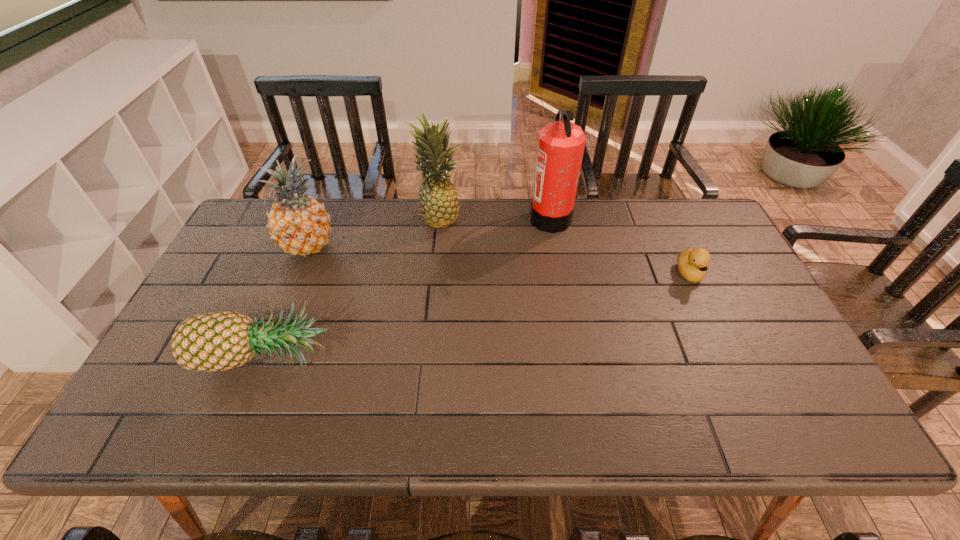
Identify the location of empty space that is in between the third object from right to left and the second shortest pineapple. click(x=373, y=232).

Where is `vacant area that lies between the second object from right to left and the third tallest object`? vacant area that lies between the second object from right to left and the third tallest object is located at coordinates (429, 231).

Where is `unoccupied area between the second shortest object and the third object from right to left`? unoccupied area between the second shortest object and the third object from right to left is located at coordinates (352, 286).

In order to click on object that ranks as the second closest to the shortest pineapple in this screenshot , I will do `click(438, 203)`.

Where is `the second closest object to the second object from right to left`? Image resolution: width=960 pixels, height=540 pixels. the second closest object to the second object from right to left is located at coordinates (692, 264).

At what (x,y) coordinates should I click in order to perform the action: click on the closest pineapple to the rightmost object. Please return your answer as a coordinate pair (x, y). Looking at the image, I should click on (438, 203).

Identify which pineapple is located as the second nearest to the third shortest object. Please provide its 2D coordinates. Your answer should be formatted as a tuple, i.e. [(x, y)], where the tuple contains the x and y coordinates of a point satisfying the conditions above.

[(438, 203)]